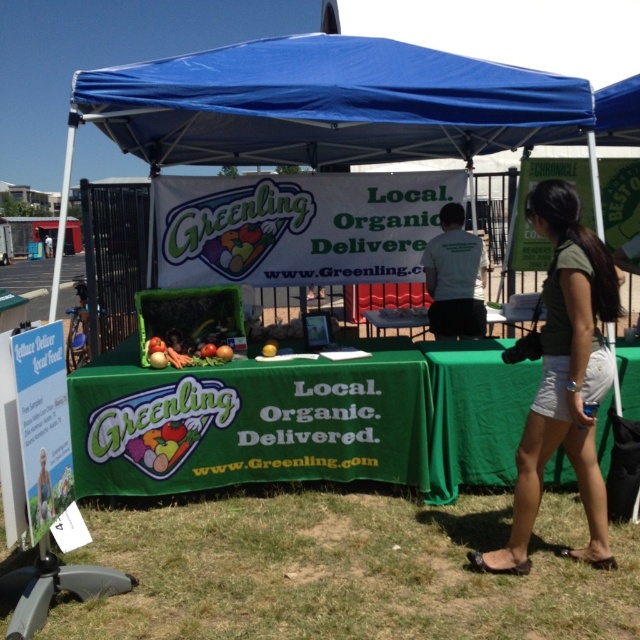
Who is lower down, green cloth tablecloth at lower right or white cotton shirt at center?

green cloth tablecloth at lower right

The width and height of the screenshot is (640, 640). What do you see at coordinates (474, 413) in the screenshot?
I see `green cloth tablecloth at lower right` at bounding box center [474, 413].

Where is `green cloth tablecloth at lower right`? green cloth tablecloth at lower right is located at coordinates (474, 413).

Locate an element on the screen. green cloth tablecloth at lower right is located at coordinates (474, 413).

Does white cotton shirt at center appear over matte plastic bag of vegetables at center?

Correct, white cotton shirt at center is located above matte plastic bag of vegetables at center.

Find the location of a particular element. white cotton shirt at center is located at coordinates (454, 278).

Which of these two, green fabric table at center or green fabric shorts at lower right, stands taller?

green fabric shorts at lower right

Between point (404, 368) and point (552, 348), which one is positioned behind?

The point (404, 368) is more distant.

Where is `green fabric table at center`? This screenshot has height=640, width=640. green fabric table at center is located at coordinates (250, 422).